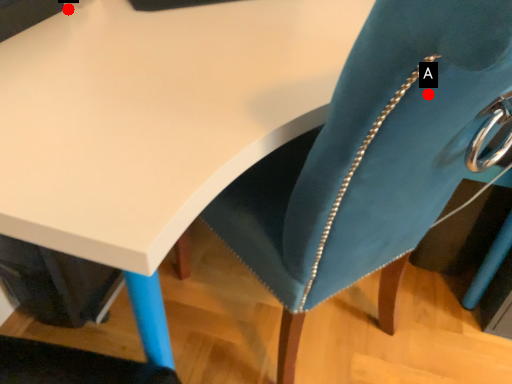
Question: Two points are circled on the image, labeled by A and B beside each circle. Among these points, which one is farthest from the camera?

Choices:
 (A) A is further
 (B) B is further

Answer: (B)